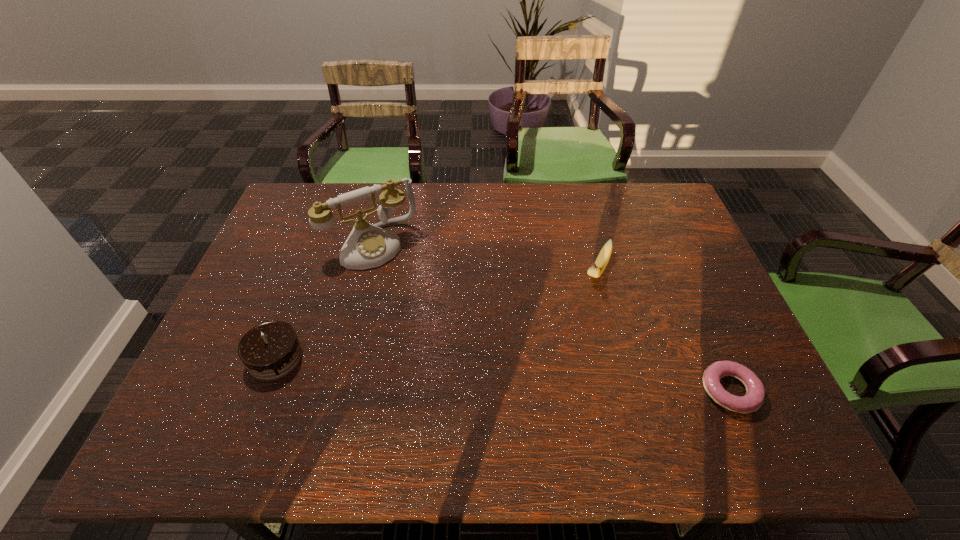
Find the location of a particular element. free spot that satisfies the following two spatial constraints: 1. on the front side of the tallest object; 2. on the right side of the doughnut is located at coordinates (334, 391).

The image size is (960, 540). I want to click on free space that satisfies the following two spatial constraints: 1. on the back side of the second object from right to left; 2. on the right side of the chocolate cake, so click(x=308, y=272).

You are a GUI agent. You are given a task and a screenshot of the screen. Output one action in this format:
    pyautogui.click(x=<x>, y=<y>)
    Task: Click on the free location that satisfies the following two spatial constraints: 1. on the front side of the second object from right to left; 2. on the left side of the tallest object
    The height and width of the screenshot is (540, 960).
    Given the screenshot: What is the action you would take?
    pyautogui.click(x=365, y=272)